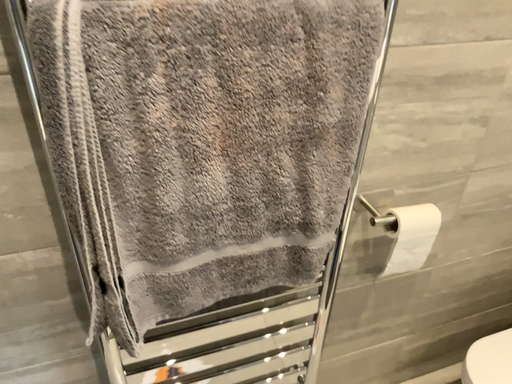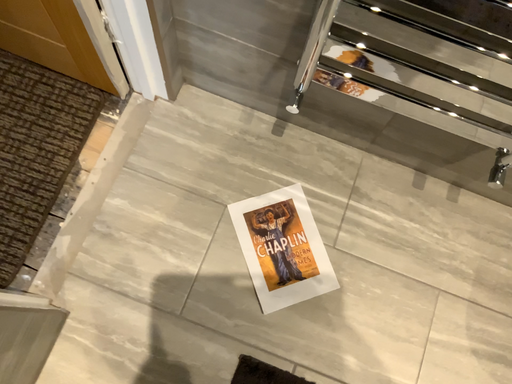
Question: How did the camera likely rotate when shooting the video?

Choices:
 (A) rotated upward
 (B) rotated downward

Answer: (B)